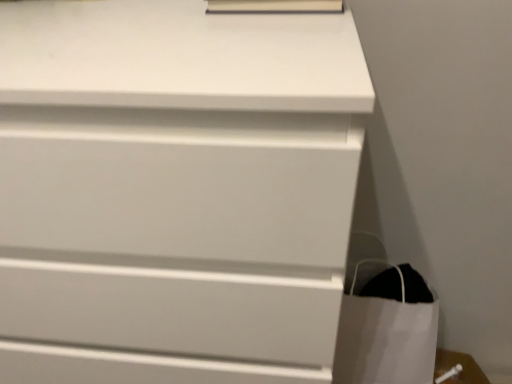
Find the location of `free location to the left of matte white book at upper center`. free location to the left of matte white book at upper center is located at coordinates (135, 19).